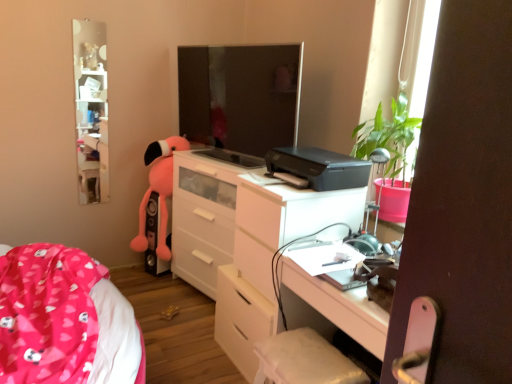
Question: Is pink fabric bed at lower left a part of white glossy chest of drawers at center?

Choices:
 (A) no
 (B) yes

Answer: (A)

Question: From a real-world perspective, is white glossy chest of drawers at center on top of pink fabric bed at lower left?

Choices:
 (A) yes
 (B) no

Answer: (B)

Question: Is white glossy chest of drawers at center located outside pink fabric bed at lower left?

Choices:
 (A) yes
 (B) no

Answer: (A)

Question: From the image's perspective, is white glossy chest of drawers at center located above pink fabric bed at lower left?

Choices:
 (A) no
 (B) yes

Answer: (B)

Question: From a real-world perspective, is white glossy chest of drawers at center under pink fabric bed at lower left?

Choices:
 (A) no
 (B) yes

Answer: (B)

Question: Is white glossy chest of drawers at center further to camera compared to pink fabric bed at lower left?

Choices:
 (A) yes
 (B) no

Answer: (A)

Question: From a real-world perspective, is white glossy chest of drawers at center over white glossy cabinet at upper left?

Choices:
 (A) yes
 (B) no

Answer: (B)

Question: Considering the relative sizes of white glossy chest of drawers at center and white glossy cabinet at upper left in the image provided, is white glossy chest of drawers at center taller than white glossy cabinet at upper left?

Choices:
 (A) yes
 (B) no

Answer: (B)

Question: Is white glossy chest of drawers at center bigger than white glossy cabinet at upper left?

Choices:
 (A) yes
 (B) no

Answer: (A)

Question: From the image's perspective, would you say white glossy chest of drawers at center is shown under white glossy cabinet at upper left?

Choices:
 (A) yes
 (B) no

Answer: (A)

Question: Could you tell me if white glossy chest of drawers at center is turned towards white glossy cabinet at upper left?

Choices:
 (A) no
 (B) yes

Answer: (A)

Question: Is white glossy cabinet at upper left inside white glossy chest of drawers at center?

Choices:
 (A) no
 (B) yes

Answer: (A)

Question: From a real-world perspective, is black plastic printer at center over white fabric swivel chair at lower center?

Choices:
 (A) yes
 (B) no

Answer: (A)